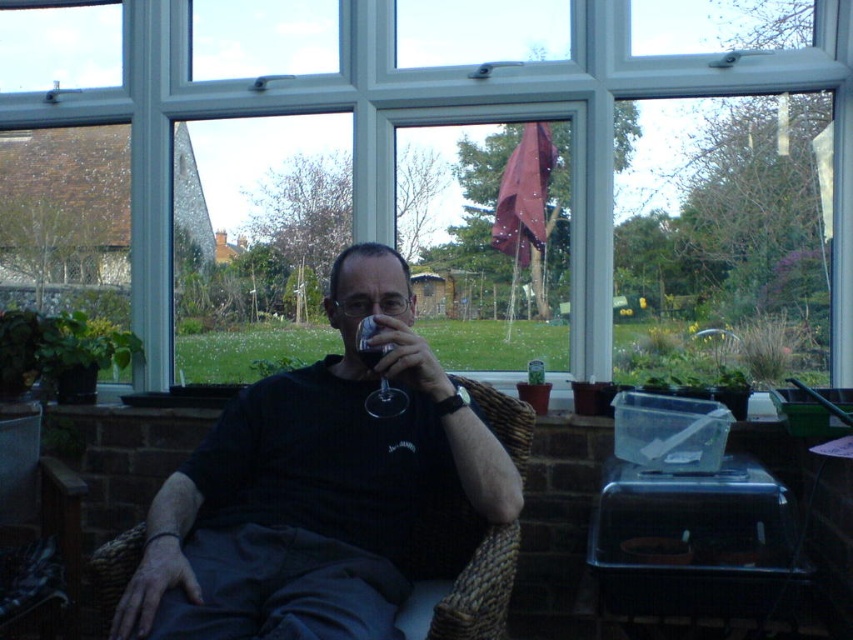
Looking at this image, who is taller, brown woven armchair at lower left or translucent glass wine at center?

brown woven armchair at lower left

Does point (26, 454) come in front of point (376, 349)?

No, it is not.

Where is `brown woven armchair at lower left`? Image resolution: width=853 pixels, height=640 pixels. brown woven armchair at lower left is located at coordinates (38, 536).

Is transparent glass window at center smaller than transparent glass at center?

No, transparent glass window at center is not smaller than transparent glass at center.

Does transparent glass window at center appear on the left side of transparent glass at center?

Correct, you'll find transparent glass window at center to the left of transparent glass at center.

Where is `transparent glass window at center`? transparent glass window at center is located at coordinates (440, 124).

You are a GUI agent. You are given a task and a screenshot of the screen. Output one action in this format:
    pyautogui.click(x=<x>, y=<y>)
    Task: Click on the transparent glass window at center
    The height and width of the screenshot is (640, 853).
    Given the screenshot: What is the action you would take?
    pyautogui.click(x=440, y=124)

Which is in front, point (207, 560) or point (364, 365)?

Positioned in front is point (207, 560).

Can you confirm if black matte shirt at center is positioned below transparent glass at center?

Indeed, black matte shirt at center is positioned under transparent glass at center.

Who is more distant from viewer, [375,545] or [386,417]?

Positioned behind is point [386,417].

Find the location of a particular element. The width and height of the screenshot is (853, 640). black matte shirt at center is located at coordinates (314, 486).